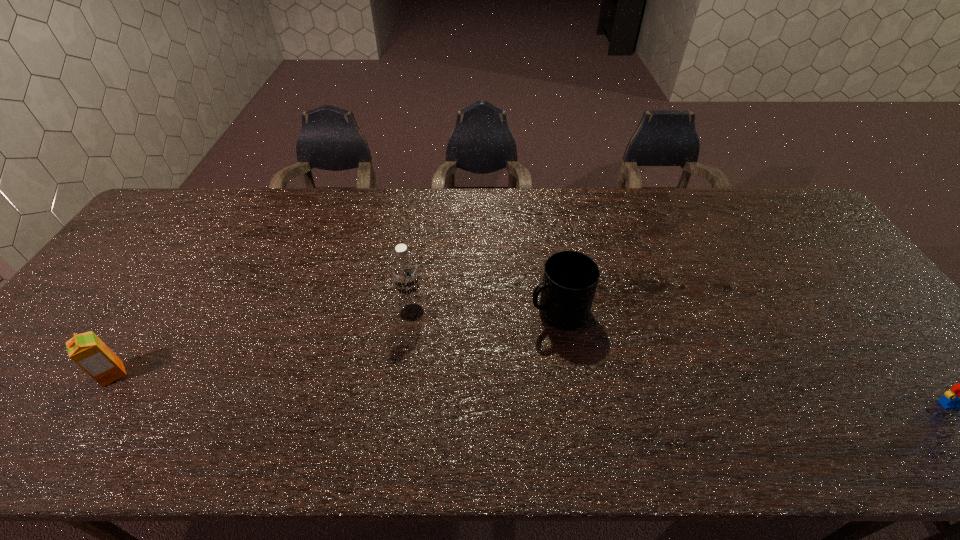
What are the coordinates of `empty location between the vodka and the leftmost object` in the screenshot? It's located at (x=262, y=343).

Identify which object is the third nearest to the second nearest object. Please provide its 2D coordinates. Your answer should be formatted as a tuple, i.e. [(x, y)], where the tuple contains the x and y coordinates of a point satisfying the conditions above.

[(959, 397)]

You are a GUI agent. You are given a task and a screenshot of the screen. Output one action in this format:
    pyautogui.click(x=<x>, y=<y>)
    Task: Click on the object that is the second closest to the Lego
    This screenshot has height=540, width=960.
    Given the screenshot: What is the action you would take?
    pyautogui.click(x=405, y=274)

You are a GUI agent. You are given a task and a screenshot of the screen. Output one action in this format:
    pyautogui.click(x=<x>, y=<y>)
    Task: Click on the vacant region that satisfies the following two spatial constraints: 1. on the back side of the leftmost object; 2. on the left side of the mug
    
    Given the screenshot: What is the action you would take?
    pyautogui.click(x=154, y=312)